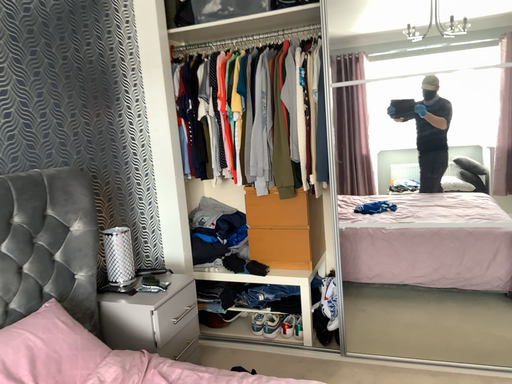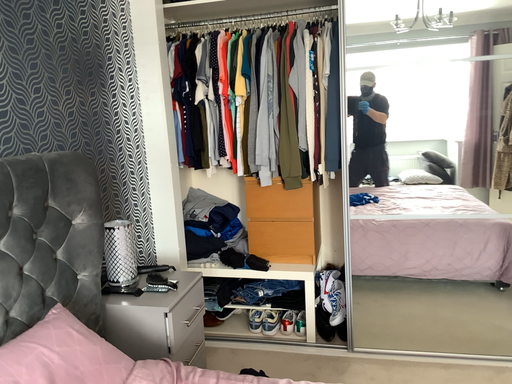
Question: How did the camera likely rotate when shooting the video?

Choices:
 (A) rotated left
 (B) rotated right

Answer: (B)